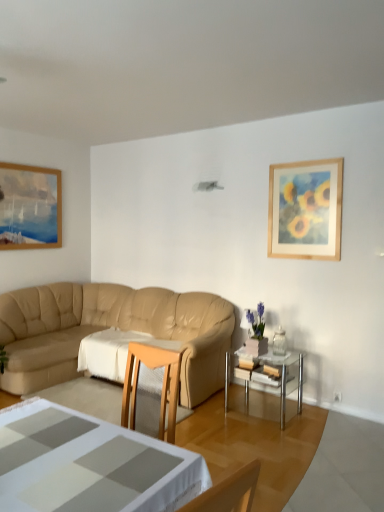
At what (x,y) coordinates should I click in order to perform the action: click on free space underneath clear glass table at center (from a real-world perspective). Please return your answer as a coordinate pair (x, y). The width and height of the screenshot is (384, 512). Looking at the image, I should click on click(x=269, y=411).